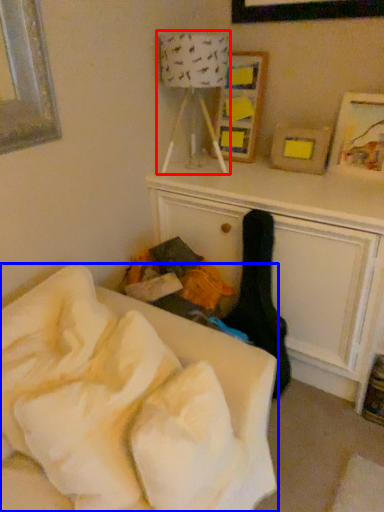
Question: Among these objects, which one is nearest to the camera, lamp (highlighted by a red box) or furniture (highlighted by a blue box)?

Choices:
 (A) lamp
 (B) furniture

Answer: (B)